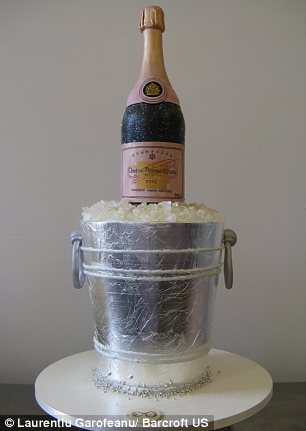
Identify the location of bucket. This screenshot has height=431, width=306. (205, 314).